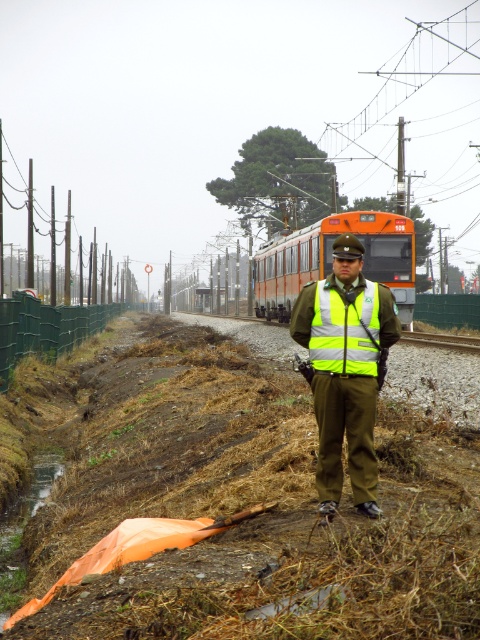
You are a passenger on the approaching train and want to know if the reflective yellow vest at center is between you and the gravel train track at center. Based on the scene, can you determine this?

Answer: The reflective yellow vest at center is closer to the viewer than the gravel train track at center, so yes, the reflective yellow vest at center is between you and the gravel train track at center.

You are a railway engineer assessing safety protocols. You observe the orange matte train at center and the yellow reflective safety vest at center. Which object is taller?

The orange matte train at center is much taller than the yellow reflective safety vest at center.